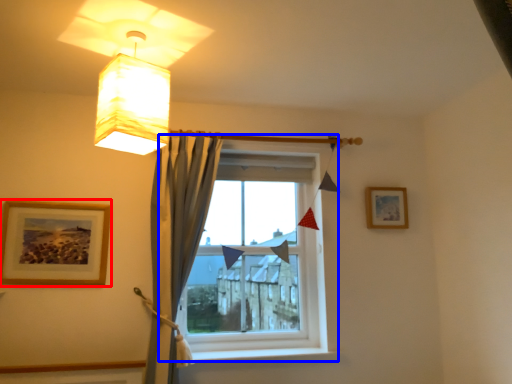
Question: Among these objects, which one is farthest to the camera, picture frame (highlighted by a red box) or window (highlighted by a blue box)?

Choices:
 (A) picture frame
 (B) window

Answer: (B)